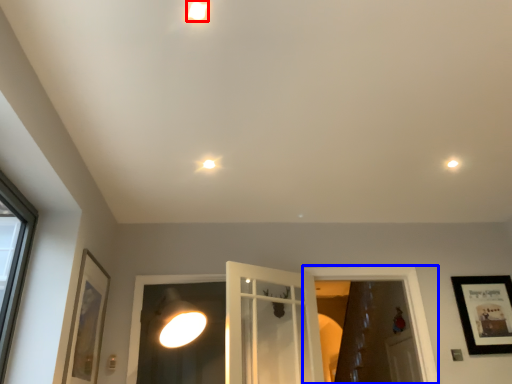
Question: Which point is closer to the camera, droplight (highlighted by a red box) or window frame (highlighted by a blue box)?

Choices:
 (A) droplight
 (B) window frame

Answer: (A)